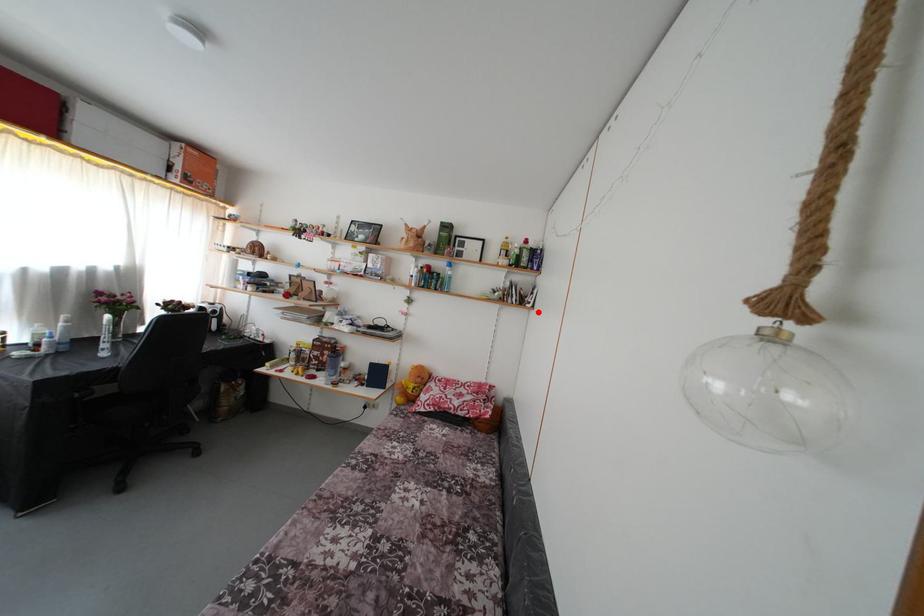
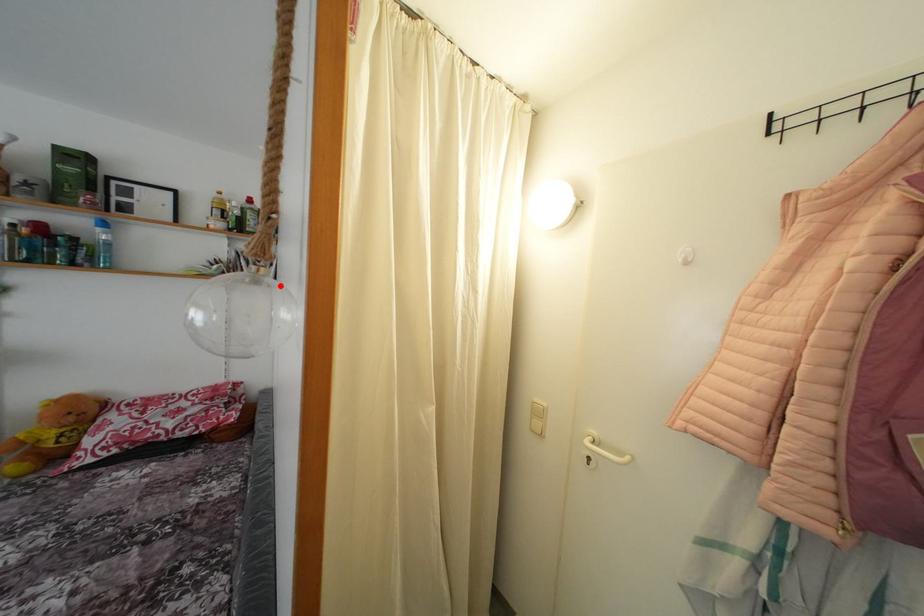
I am providing you with two images of the same scene from different viewpoints. A red point is marked on the first image and another point is marked on the second image. Is the red point in image1 aligned with the point shown in image2?

Yes